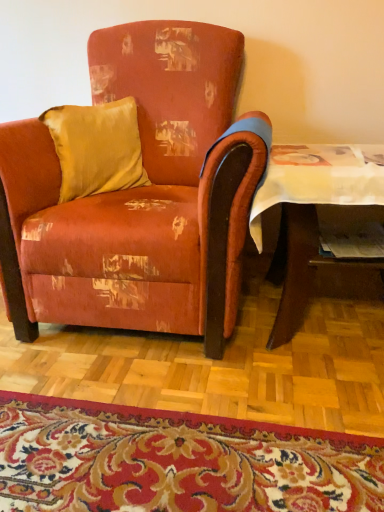
Image resolution: width=384 pixels, height=512 pixels. Describe the element at coordinates (176, 461) in the screenshot. I see `carpet with floral pattern at lower center` at that location.

Image resolution: width=384 pixels, height=512 pixels. Find the location of `velvet orange armchair at center`. velvet orange armchair at center is located at coordinates (138, 196).

Where is `carpet with floral pattern at lower center`? The height and width of the screenshot is (512, 384). carpet with floral pattern at lower center is located at coordinates (176, 461).

From the image's perspective, is wooden table at lower right above or below carpet with floral pattern at lower center?

From the image's perspective, wooden table at lower right appears above carpet with floral pattern at lower center.

Looking at this image, can you confirm if wooden table at lower right is shorter than carpet with floral pattern at lower center?

No, wooden table at lower right is not shorter than carpet with floral pattern at lower center.

How distant is wooden table at lower right from carpet with floral pattern at lower center?

The distance of wooden table at lower right from carpet with floral pattern at lower center is 23.33 inches.

Considering the positions of objects wooden table at lower right and carpet with floral pattern at lower center in the image provided, who is behind, wooden table at lower right or carpet with floral pattern at lower center?

Positioned behind is wooden table at lower right.

Considering the relative sizes of wooden table at lower right and satin gold pillow at upper left in the image provided, is wooden table at lower right wider than satin gold pillow at upper left?

Indeed, wooden table at lower right has a greater width compared to satin gold pillow at upper left.

From the image's perspective, is wooden table at lower right under satin gold pillow at upper left?

Yes, from the image's perspective, wooden table at lower right is below satin gold pillow at upper left.

Which point is more forward, [314,197] or [71,162]?

Point [314,197]

Is wooden table at lower right far away from satin gold pillow at upper left?

wooden table at lower right is near satin gold pillow at upper left, not far away.

Is carpet with floral pattern at lower center taller or shorter than velvet orange armchair at center?

Clearly, carpet with floral pattern at lower center is shorter compared to velvet orange armchair at center.

Can we say carpet with floral pattern at lower center lies outside velvet orange armchair at center?

carpet with floral pattern at lower center lies outside velvet orange armchair at center's area.

From the picture: Is carpet with floral pattern at lower center to the left or to the right of velvet orange armchair at center in the image?

Clearly, carpet with floral pattern at lower center is on the right of velvet orange armchair at center in the image.

Between carpet with floral pattern at lower center and velvet orange armchair at center, which one has smaller size?

With smaller size is carpet with floral pattern at lower center.

Which object is closer to the camera, wooden table at lower right or matte paper magazine at lower right?

wooden table at lower right is closer to the camera.

Which of these two, wooden table at lower right or matte paper magazine at lower right, is thinner?

Thinner between the two is matte paper magazine at lower right.

Locate an element on the screen. The width and height of the screenshot is (384, 512). table located on the left of matte paper magazine at lower right is located at coordinates (312, 208).

From the image's perspective, is wooden table at lower right below matte paper magazine at lower right?

Indeed, from the image's perspective, wooden table at lower right is shown beneath matte paper magazine at lower right.

Does point (321, 165) come in front of point (190, 52)?

Yes, it is in front of point (190, 52).

Could you tell me if wooden table at lower right is turned towards velvet orange armchair at center?

No.

Is wooden table at lower right in contact with velvet orange armchair at center?

wooden table at lower right and velvet orange armchair at center are clearly separated.

Does wooden table at lower right have a lesser width compared to velvet orange armchair at center?

Correct, the width of wooden table at lower right is less than that of velvet orange armchair at center.

Is carpet with floral pattern at lower center bigger or smaller than wooden table at lower right?

Clearly, carpet with floral pattern at lower center is smaller in size than wooden table at lower right.

Which object is positioned more to the left, carpet with floral pattern at lower center or wooden table at lower right?

carpet with floral pattern at lower center is more to the left.

From a real-world perspective, is carpet with floral pattern at lower center positioned under wooden table at lower right based on gravity?

Correct, in the physical world, carpet with floral pattern at lower center is lower than wooden table at lower right.

Between carpet with floral pattern at lower center and wooden table at lower right, which one has larger width?

carpet with floral pattern at lower center.

How far apart are velvet orange armchair at center and satin gold pillow at upper left?

velvet orange armchair at center is 9.47 inches from satin gold pillow at upper left.

Considering the relative sizes of velvet orange armchair at center and satin gold pillow at upper left in the image provided, is velvet orange armchair at center taller than satin gold pillow at upper left?

Indeed, velvet orange armchair at center has a greater height compared to satin gold pillow at upper left.

Looking at this image, from a real-world perspective, is velvet orange armchair at center positioned under satin gold pillow at upper left based on gravity?

Yes.

Considering the positions of points (112, 227) and (132, 158), is point (112, 227) closer to camera compared to point (132, 158)?

Yes, point (112, 227) is closer to viewer.

Image resolution: width=384 pixels, height=512 pixels. In order to click on mat lying on the left of wooden table at lower right in this screenshot , I will do `click(176, 461)`.

There is a wooden table at lower right. Where is `pillow above it (from a real-world perspective)`? pillow above it (from a real-world perspective) is located at coordinates (96, 147).

From the image, which object appears to be farther from matte paper magazine at lower right, wooden table at lower right or carpet with floral pattern at lower center?

carpet with floral pattern at lower center lies further to matte paper magazine at lower right than the other object.

From the image, which object appears to be farther from velvet orange armchair at center, satin gold pillow at upper left or wooden table at lower right?

The object further to velvet orange armchair at center is wooden table at lower right.

Estimate the real-world distances between objects in this image. Which object is closer to satin gold pillow at upper left, carpet with floral pattern at lower center or wooden table at lower right?

wooden table at lower right is closer to satin gold pillow at upper left.

When comparing their distances from matte paper magazine at lower right, does wooden table at lower right or satin gold pillow at upper left seem closer?

wooden table at lower right lies closer to matte paper magazine at lower right than the other object.

Considering their positions, is wooden table at lower right positioned further to carpet with floral pattern at lower center than velvet orange armchair at center?

wooden table at lower right is further to carpet with floral pattern at lower center.

Based on the photo, when comparing their distances from velvet orange armchair at center, does carpet with floral pattern at lower center or satin gold pillow at upper left seem closer?

Based on the image, satin gold pillow at upper left appears to be nearer to velvet orange armchair at center.

Estimate the real-world distances between objects in this image. Which object is further from satin gold pillow at upper left, velvet orange armchair at center or matte paper magazine at lower right?

matte paper magazine at lower right is further to satin gold pillow at upper left.

When comparing their distances from velvet orange armchair at center, does wooden table at lower right or satin gold pillow at upper left seem closer?

satin gold pillow at upper left.

The height and width of the screenshot is (512, 384). Find the location of `table located between satin gold pillow at upper left and matte paper magazine at lower right in the left-right direction`. table located between satin gold pillow at upper left and matte paper magazine at lower right in the left-right direction is located at coordinates (312, 208).

Identify the location of magazine between velvet orange armchair at center and carpet with floral pattern at lower center in the up-down direction. This screenshot has height=512, width=384. (352, 240).

The width and height of the screenshot is (384, 512). Identify the location of table between satin gold pillow at upper left and carpet with floral pattern at lower center from top to bottom. (312, 208).

This screenshot has height=512, width=384. I want to click on chair between satin gold pillow at upper left and matte paper magazine at lower right, so click(138, 196).